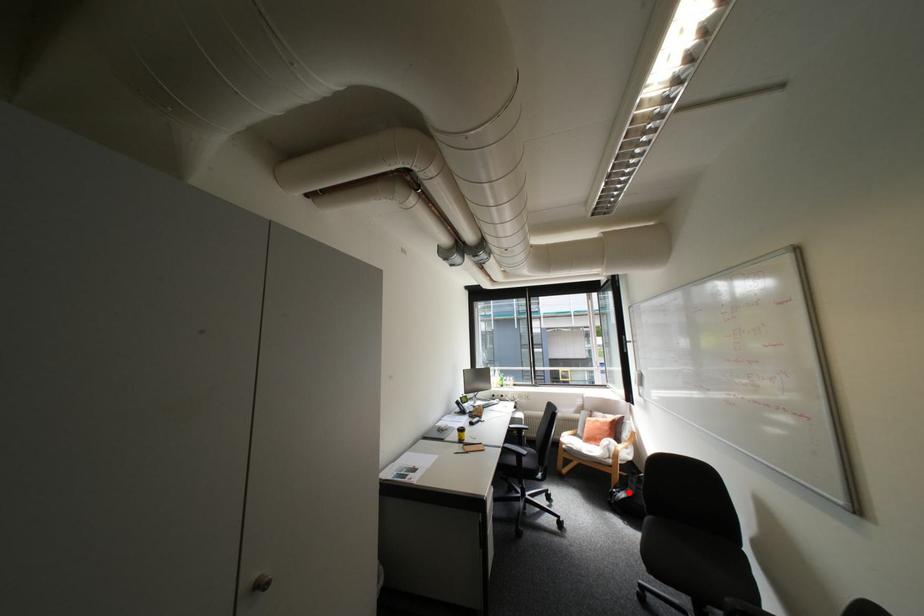
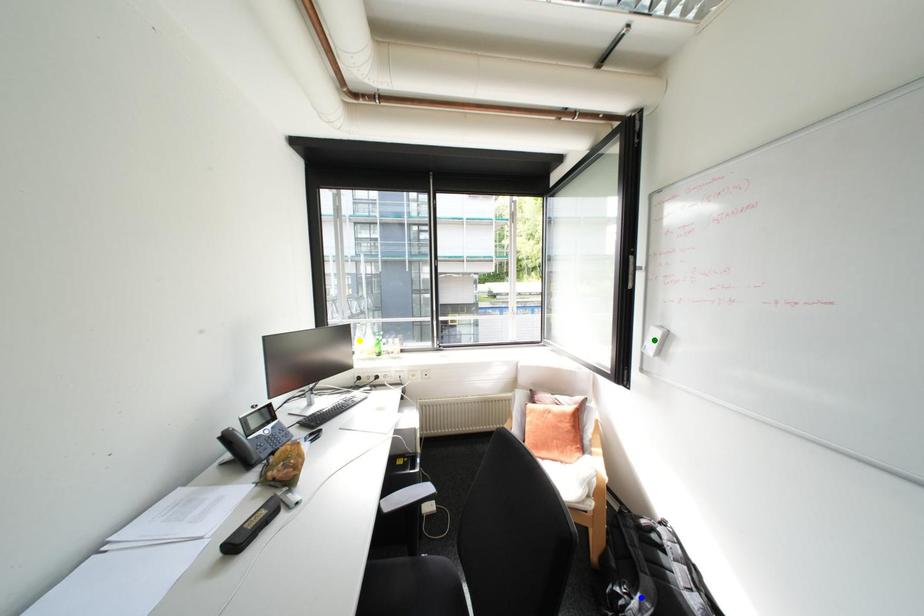
Question: I am providing you with two images of the same scene from different viewpoints. A red point is marked on the first image. You are given multiple points on the second image. Can you choose the point in image 2 that corresponds to the point in image 1?

Choices:
 (A) yellow point
 (B) green point
 (C) blue point

Answer: (C)